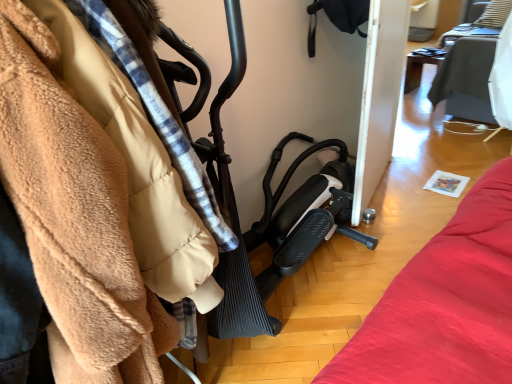
Question: From a real-world perspective, is black rubber baby carriage at center on top of wooden table at upper right?

Choices:
 (A) yes
 (B) no

Answer: (A)

Question: Is black rubber baby carriage at center aimed at wooden table at upper right?

Choices:
 (A) no
 (B) yes

Answer: (A)

Question: From a real-world perspective, is black rubber baby carriage at center physically below wooden table at upper right?

Choices:
 (A) no
 (B) yes

Answer: (A)

Question: Does black rubber baby carriage at center have a smaller size compared to wooden table at upper right?

Choices:
 (A) yes
 (B) no

Answer: (B)

Question: From the image's perspective, is black rubber baby carriage at center on top of wooden table at upper right?

Choices:
 (A) yes
 (B) no

Answer: (B)

Question: Is black rubber baby carriage at center positioned behind wooden table at upper right?

Choices:
 (A) no
 (B) yes

Answer: (A)

Question: From the image's perspective, is wooden table at upper right on top of black rubber baby carriage at center?

Choices:
 (A) no
 (B) yes

Answer: (B)

Question: Is wooden table at upper right wider than black rubber baby carriage at center?

Choices:
 (A) yes
 (B) no

Answer: (B)

Question: Is wooden table at upper right further to camera compared to black rubber baby carriage at center?

Choices:
 (A) yes
 (B) no

Answer: (A)

Question: From a real-world perspective, is wooden table at upper right positioned under black rubber baby carriage at center based on gravity?

Choices:
 (A) yes
 (B) no

Answer: (A)

Question: Are wooden table at upper right and black rubber baby carriage at center located far from each other?

Choices:
 (A) no
 (B) yes

Answer: (B)

Question: Is wooden table at upper right to the left of black rubber baby carriage at center from the viewer's perspective?

Choices:
 (A) yes
 (B) no

Answer: (B)

Question: Based on their sizes in the image, would you say wooden table at upper right is bigger or smaller than black rubber baby carriage at center?

Choices:
 (A) big
 (B) small

Answer: (B)